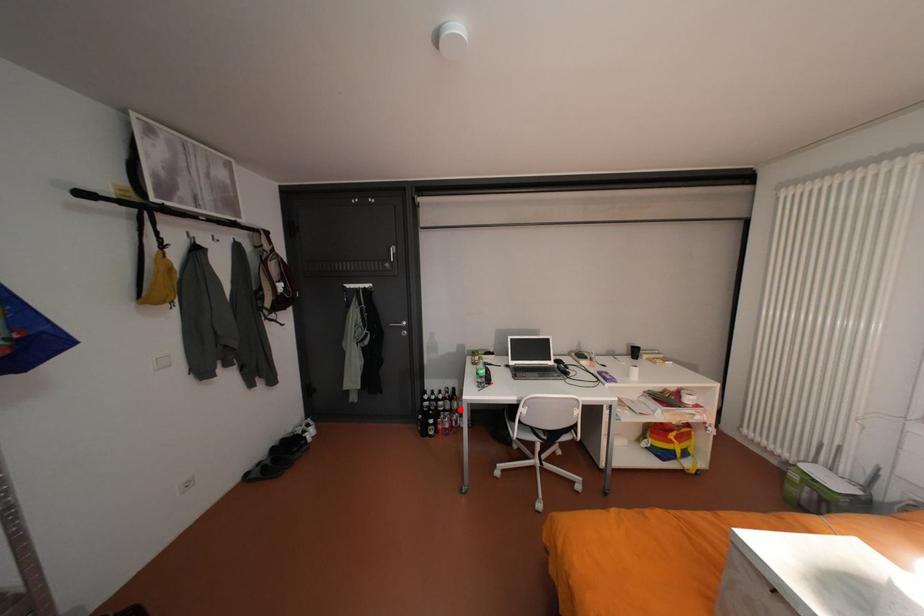
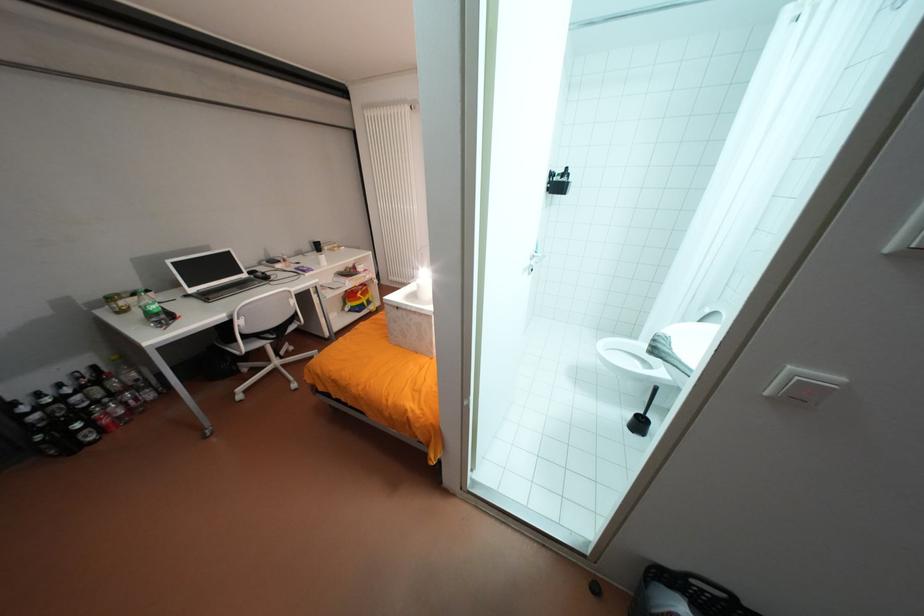
Locate, in the second image, the point that corresponds to the highlighted location in the first image.

(120, 394)